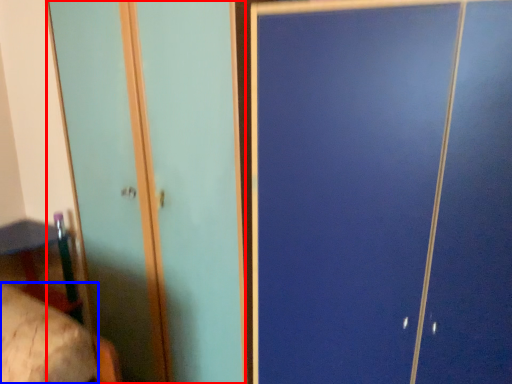
Question: Which object is further to the camera taking this photo, screen door (highlighted by a red box) or mattress (highlighted by a blue box)?

Choices:
 (A) screen door
 (B) mattress

Answer: (A)